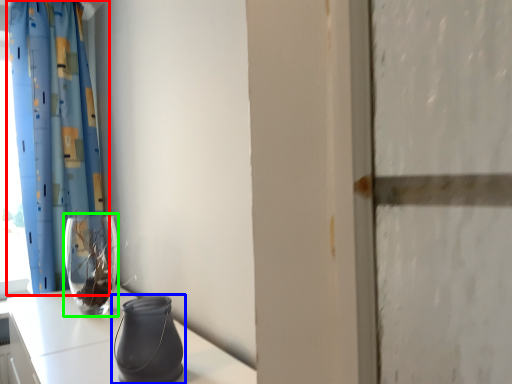
Question: Which object is positioned farthest from curtain (highlighted by a red box)? Select from vase (highlighted by a blue box) and vase (highlighted by a green box).

Choices:
 (A) vase
 (B) vase

Answer: (A)